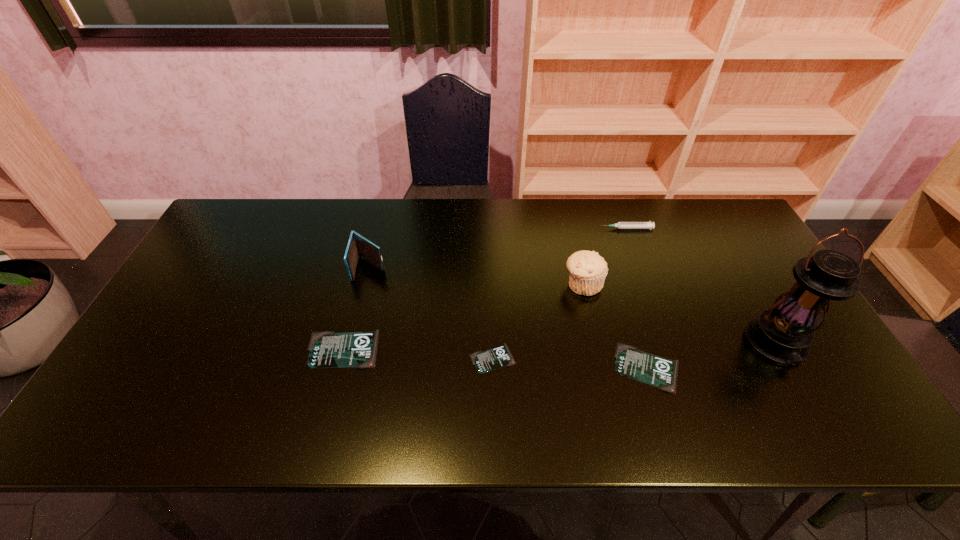
Where is `blank region between the muffin and the second shortest identity card`? blank region between the muffin and the second shortest identity card is located at coordinates (615, 326).

The image size is (960, 540). I want to click on free space between the leftmost identity card and the lantern, so [x=560, y=347].

Image resolution: width=960 pixels, height=540 pixels. Find the location of `free space between the leftmost identity card and the wallet`. free space between the leftmost identity card and the wallet is located at coordinates (356, 308).

This screenshot has width=960, height=540. Identify the location of unoccupied position between the muffin and the lantern. (680, 314).

Identify the location of vacant area between the syringe and the wallet. (498, 248).

At what (x,y) coordinates should I click in order to perform the action: click on vacant area that lies between the wallet and the muffin. Please return your answer as a coordinate pair (x, y). Looking at the image, I should click on (476, 276).

This screenshot has height=540, width=960. Find the location of `blank region between the muffin and the leftmost identity card`. blank region between the muffin and the leftmost identity card is located at coordinates (463, 316).

I want to click on vacant space that's between the leftmost identity card and the wallet, so click(x=356, y=308).

Identify which object is the nearest to the muffin. Please provide its 2D coordinates. Your answer should be formatted as a tuple, i.e. [(x, y)], where the tuple contains the x and y coordinates of a point satisfying the conditions above.

[(644, 367)]

Where is `object that is the second nearest to the farthest object`? object that is the second nearest to the farthest object is located at coordinates (782, 334).